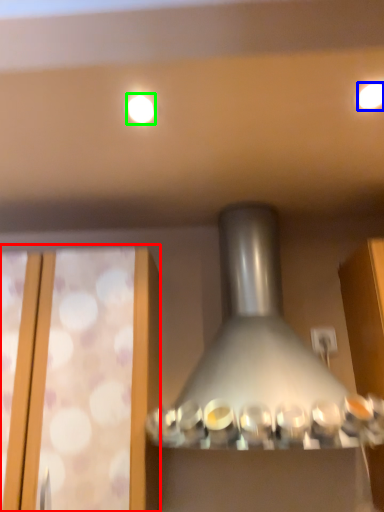
Question: Estimate the real-world distances between objects in this image. Which object is closer to glass door (highlighted by a red box), lighting (highlighted by a blue box) or lighting (highlighted by a green box)?

Choices:
 (A) lighting
 (B) lighting

Answer: (B)